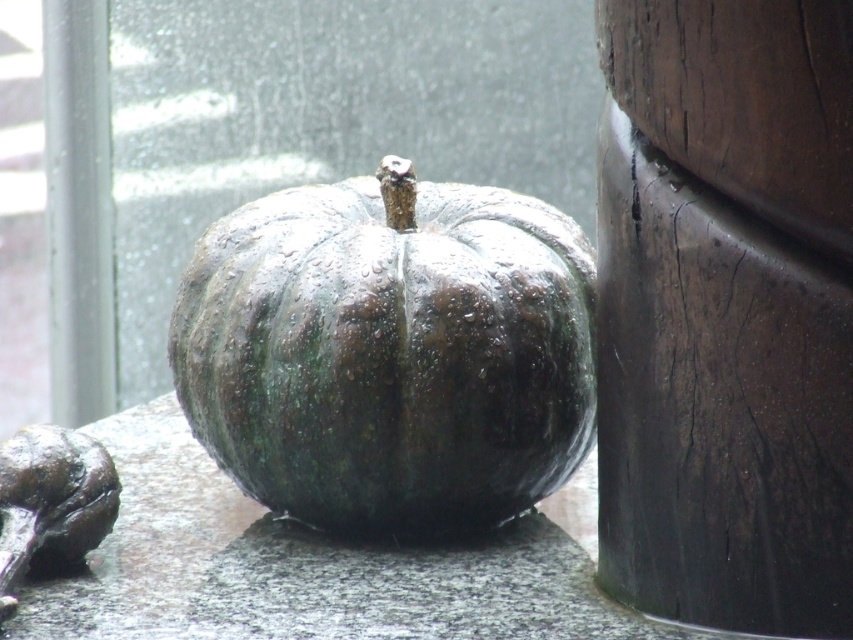
Does dark brown wood at right appear under wet dark green pumpkin at center?

Incorrect, dark brown wood at right is not positioned below wet dark green pumpkin at center.

Does point (672, 308) come closer to viewer compared to point (245, 403)?

Yes, it is in front of point (245, 403).

Describe the element at coordinates (726, 310) in the screenshot. I see `dark brown wood at right` at that location.

Locate an element on the screen. Image resolution: width=853 pixels, height=640 pixels. dark brown wood at right is located at coordinates (726, 310).